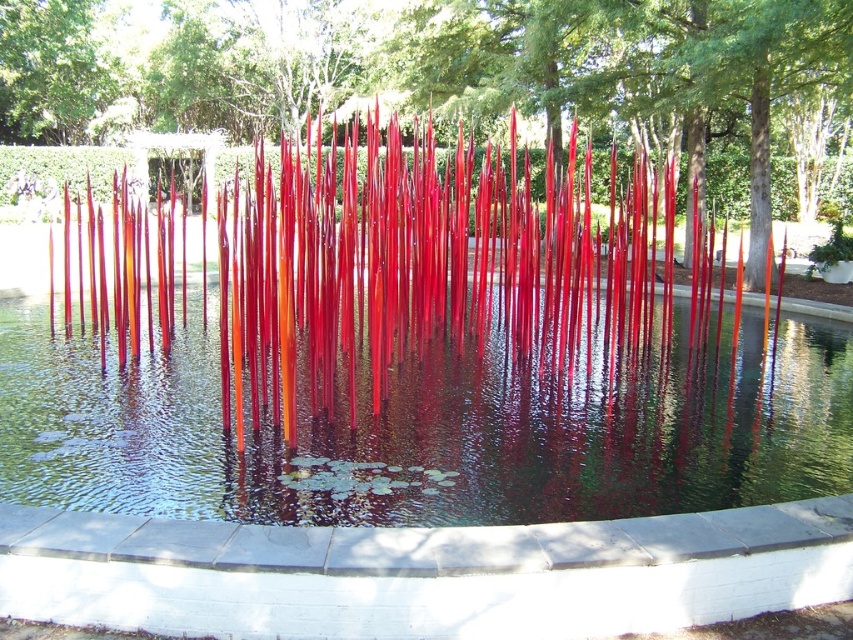
Question: Is transparent glass water at center smaller than glossy glass sculpture at center?

Choices:
 (A) yes
 (B) no

Answer: (A)

Question: In this image, where is transparent glass water at center located relative to glossy glass sculpture at center?

Choices:
 (A) right
 (B) left

Answer: (A)

Question: Which point is closer to the camera taking this photo?

Choices:
 (A) (x=726, y=88)
 (B) (x=229, y=440)

Answer: (B)

Question: Can you confirm if transparent glass water at center is positioned above glossy glass sculpture at center?

Choices:
 (A) yes
 (B) no

Answer: (B)